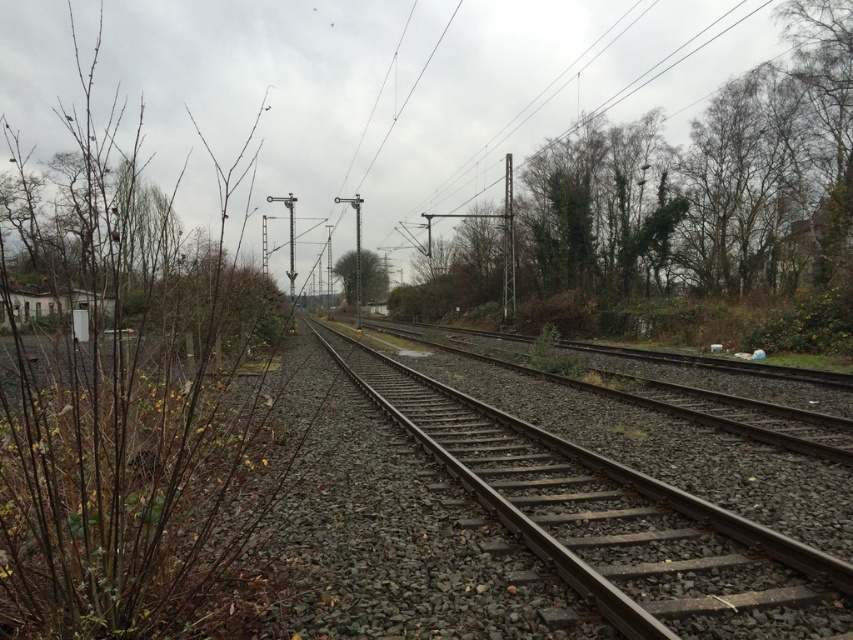
Question: Is brown woody branches at left wider than metal train track at center?

Choices:
 (A) no
 (B) yes

Answer: (B)

Question: Which object is the closest to the green leafy shrub at right?

Choices:
 (A) green leafy tree at center
 (B) brown woody branches at left

Answer: (A)

Question: Can you confirm if metal train track at center is positioned above green leafy tree at center?

Choices:
 (A) yes
 (B) no

Answer: (B)

Question: Which of these objects is positioned farthest from the green leafy shrub at right?

Choices:
 (A) metal train track at center
 (B) brown woody branches at left

Answer: (B)

Question: Is brown woody branches at left to the left of metal train track at center from the viewer's perspective?

Choices:
 (A) no
 (B) yes

Answer: (B)

Question: Which of the following is the farthest from the observer?

Choices:
 (A) brown woody branches at left
 (B) green leafy shrub at right
 (C) green leafy tree at center

Answer: (C)